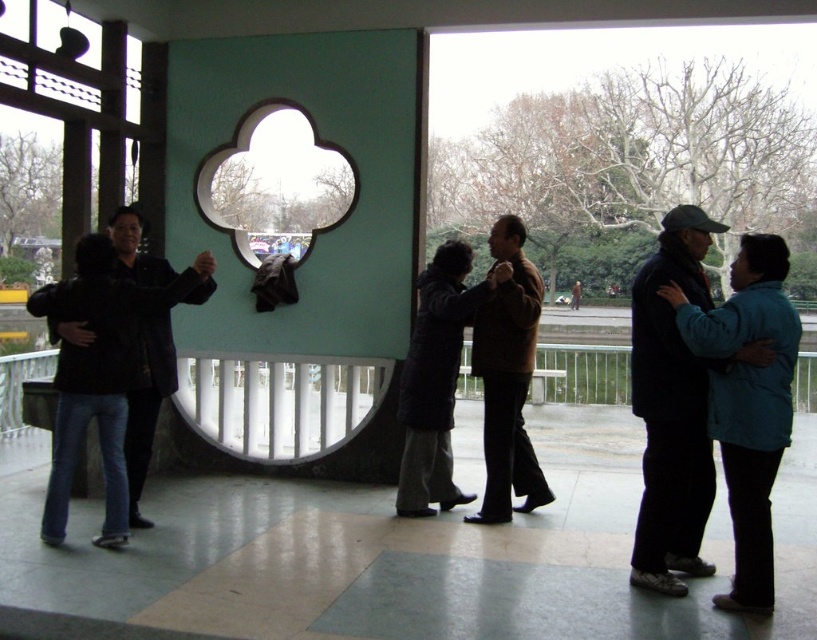
Question: Is brown wool sweater at center wider than green matte window at center?

Choices:
 (A) yes
 (B) no

Answer: (B)

Question: Is dark blue jeans at left further to camera compared to green matte window at center?

Choices:
 (A) yes
 (B) no

Answer: (B)

Question: Among these points, which one is nearest to the camera?

Choices:
 (A) (784, 316)
 (B) (172, 269)
 (C) (344, 433)

Answer: (A)

Question: Which point is closer to the camera?

Choices:
 (A) (436, 257)
 (B) (483, 376)
 (C) (570, 292)
 (D) (61, 467)

Answer: (D)

Question: Where is blue fabric jacket at right located in relation to brown wool coat at center in the image?

Choices:
 (A) left
 (B) right

Answer: (A)

Question: Which point appears farthest from the camera in this image?

Choices:
 (A) (579, 291)
 (B) (286, 115)
 (C) (105, 353)

Answer: (A)